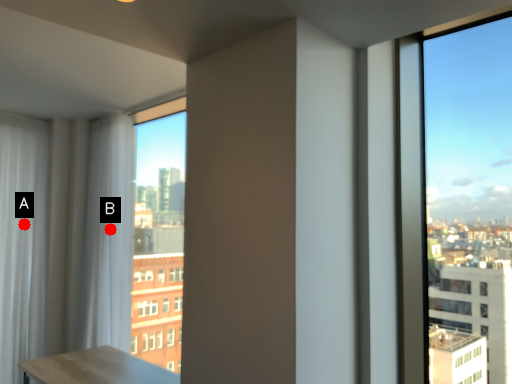
Question: Two points are circled on the image, labeled by A and B beside each circle. Which of the following is the closest to the observer?

Choices:
 (A) A is closer
 (B) B is closer

Answer: (B)